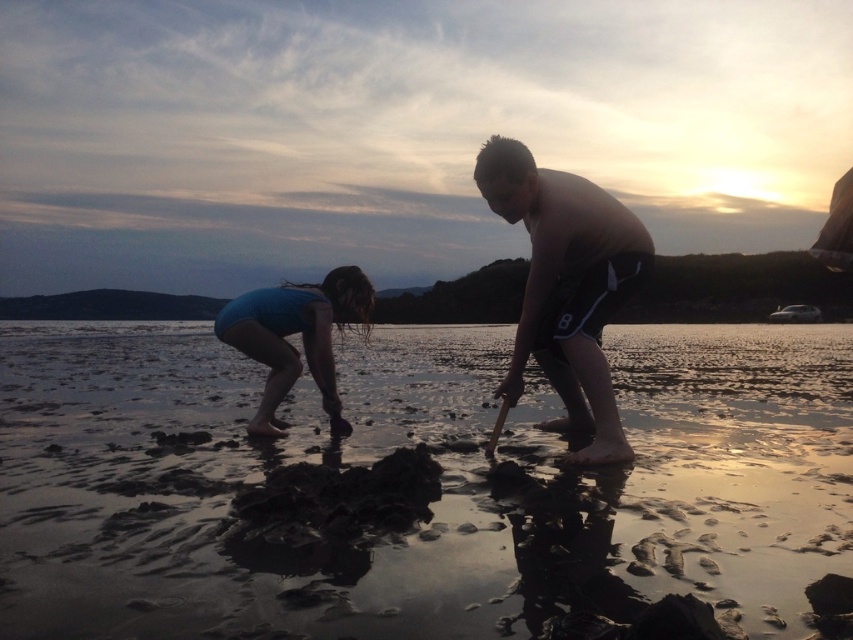
Question: Which point appears closest to the camera in this image?

Choices:
 (A) (757, 465)
 (B) (495, 209)
 (C) (299, 317)

Answer: (A)

Question: Can you confirm if muddy wet sand at lower center is wider than shiny black shorts at center?

Choices:
 (A) no
 (B) yes

Answer: (B)

Question: Is muddy wet sand at lower center above blue fabric at center?

Choices:
 (A) no
 (B) yes

Answer: (A)

Question: Among these points, which one is farthest from the camera?

Choices:
 (A) (242, 324)
 (B) (306, 394)

Answer: (B)

Question: Considering the real-world distances, which object is closest to the blue fabric at center?

Choices:
 (A) shiny black shorts at center
 (B) muddy wet sand at lower center

Answer: (A)

Question: Does shiny black shorts at center come behind blue fabric at center?

Choices:
 (A) no
 (B) yes

Answer: (A)